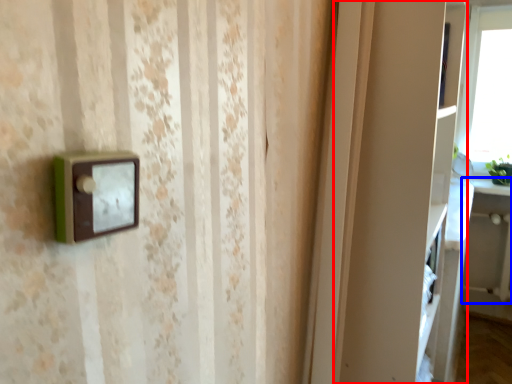
Question: Which object appears closest to the camera in this image, cabinet (highlighted by a red box) or table (highlighted by a blue box)?

Choices:
 (A) cabinet
 (B) table

Answer: (A)